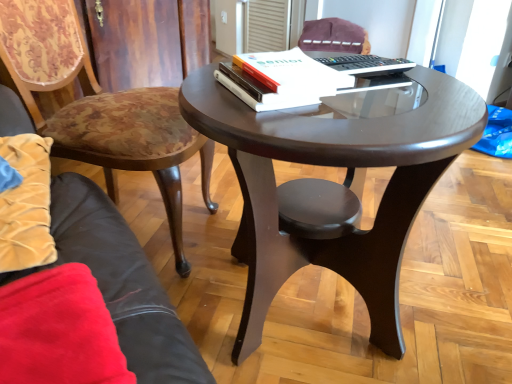
Question: Is velvet floral chair at left, arranged as the second chair when viewed from the back, taller or shorter than velvet purple chair at upper center, which is the 1th chair in top-to-bottom order?

Choices:
 (A) short
 (B) tall

Answer: (B)

Question: In terms of size, does velvet floral chair at left, acting as the second chair starting from the right, appear bigger or smaller than velvet purple chair at upper center, which ranks as the second chair in front-to-back order?

Choices:
 (A) big
 (B) small

Answer: (A)

Question: Based on their relative distances, which object is farther from the velvet floral chair at left, which is counted as the 1th chair, starting from the bottom?

Choices:
 (A) velvet purple chair at upper center, which appears as the 2th chair when viewed from the left
 (B) white plastic remote control at upper center
 (C) shiny dark wood coffee table at center
 (D) white paper at upper center

Answer: (A)

Question: Based on their relative distances, which object is farther from the white paper at upper center?

Choices:
 (A) velvet purple chair at upper center, which is the 1th chair in top-to-bottom order
 (B) white plastic remote control at upper center
 (C) velvet floral chair at left, which is the 1th chair in front-to-back order
 (D) shiny dark wood coffee table at center

Answer: (A)